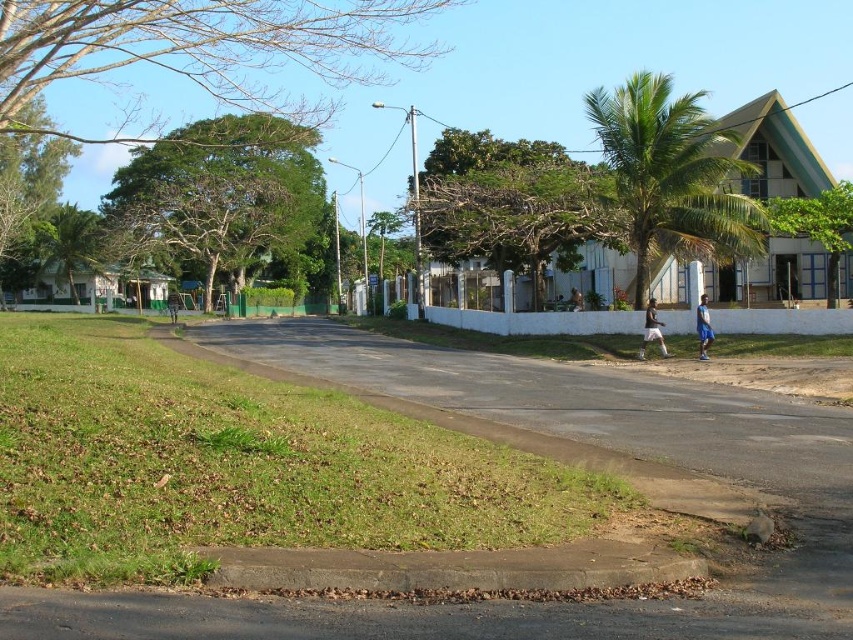
Question: Can you confirm if white fabric shorts at lower right is positioned below blue fabric shorts at lower right?

Choices:
 (A) no
 (B) yes

Answer: (B)

Question: Considering the real-world distances, which object is closest to the white fabric shorts at lower right?

Choices:
 (A) white fabric person at center
 (B) blue fabric shorts at lower right

Answer: (B)

Question: Is blue fabric shorts at lower right wider than white fabric person at center?

Choices:
 (A) no
 (B) yes

Answer: (A)

Question: Can you confirm if white fabric shorts at lower right is thinner than blue fabric shorts at lower right?

Choices:
 (A) yes
 (B) no

Answer: (B)

Question: Which point is closer to the camera taking this photo?

Choices:
 (A) (650, 305)
 (B) (573, 292)
 (C) (701, 323)

Answer: (C)

Question: Estimate the real-world distances between objects in this image. Which object is closer to the white fabric person at center?

Choices:
 (A) white fabric shorts at lower right
 (B) blue fabric shorts at lower right

Answer: (A)